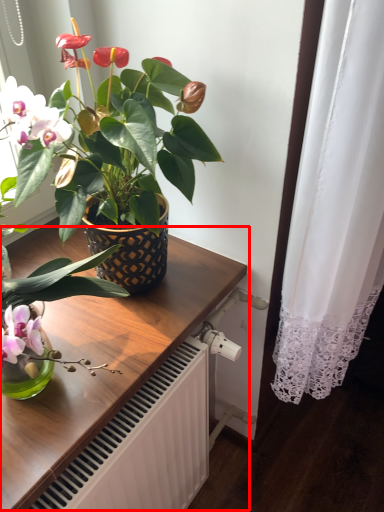
Question: From the image's perspective, considering the relative positions of table (annotated by the red box) and houseplant in the image provided, where is table (annotated by the red box) located with respect to the staircase?

Choices:
 (A) below
 (B) above

Answer: (A)